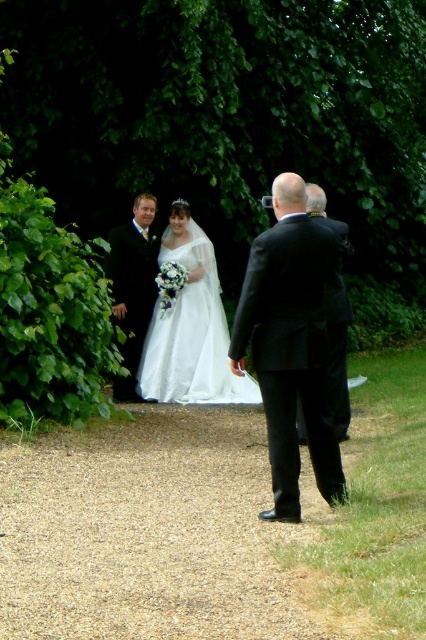
Question: Among these objects, which one is nearest to the camera?

Choices:
 (A) white satin dress at center
 (B) black satin suit at center
 (C) shiny black suit at center

Answer: (B)

Question: Observing the image, what is the correct spatial positioning of white satin dress at center in reference to black satin suit at center?

Choices:
 (A) right
 (B) left

Answer: (B)

Question: Which of these objects is positioned closest to the black satin suit at center?

Choices:
 (A) gravel path at center
 (B) black satin suit at right
 (C) white lace dress at center
 (D) white satin dress at center

Answer: (D)

Question: Does white lace dress at center come behind black satin suit at right?

Choices:
 (A) yes
 (B) no

Answer: (A)

Question: Among these objects, which one is farthest from the camera?

Choices:
 (A) white satin dress at center
 (B) black satin suit at right
 (C) gravel path at center
 (D) black satin suit at center

Answer: (B)

Question: Does gravel path at center have a smaller size compared to black satin suit at right?

Choices:
 (A) no
 (B) yes

Answer: (B)